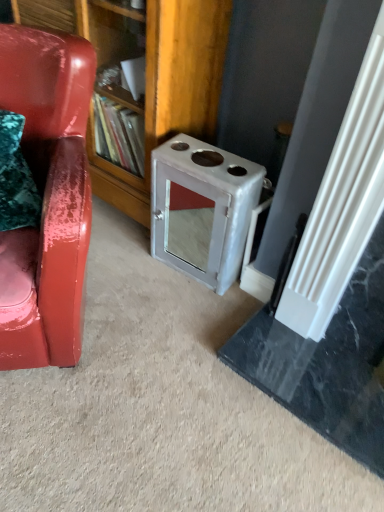
At what (x,y) coordinates should I click in order to perform the action: click on unoccupied region to the right of glossy leather chair at left. Please return your answer as a coordinate pair (x, y). The width and height of the screenshot is (384, 512). Looking at the image, I should click on (163, 340).